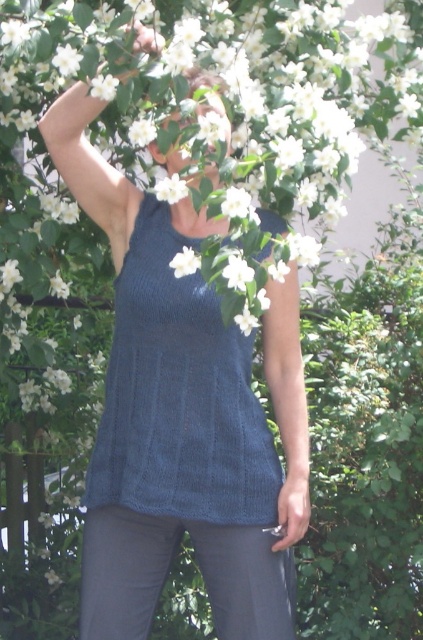
Question: Which is farther from the smooth skin head at center?

Choices:
 (A) knitted blue vest at center
 (B) knitted blue tank top at center

Answer: (A)

Question: Which object appears farthest from the camera in this image?

Choices:
 (A) knitted blue tank top at center
 (B) knitted blue vest at center
 (C) smooth skin head at center

Answer: (B)

Question: Which point is closer to the camera?

Choices:
 (A) (167, 385)
 (B) (126, 330)

Answer: (A)

Question: Can you confirm if knitted blue tank top at center is positioned above smooth skin head at center?

Choices:
 (A) no
 (B) yes

Answer: (A)

Question: Is knitted blue tank top at center positioned in front of smooth skin head at center?

Choices:
 (A) yes
 (B) no

Answer: (B)

Question: Does knitted blue tank top at center appear over smooth skin head at center?

Choices:
 (A) no
 (B) yes

Answer: (A)